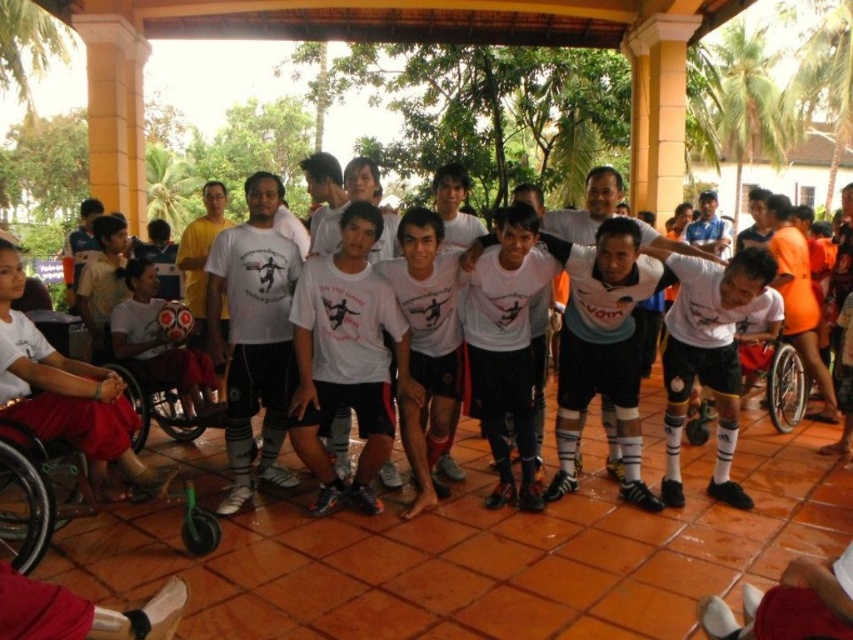
Question: Is silver metallic wheelchair at center in front of silver metallic wheelchair at left?

Choices:
 (A) no
 (B) yes

Answer: (A)

Question: Can you confirm if silver metallic wheelchair at center is wider than silver metallic wheelchair at left?

Choices:
 (A) no
 (B) yes

Answer: (A)

Question: Which point appears farthest from the camera in this image?

Choices:
 (A) (9, 419)
 (B) (374, 285)
 (C) (169, 433)
 (D) (772, 344)

Answer: (D)

Question: Which object appears closest to the camera in this image?

Choices:
 (A) matte white shirt at left
 (B) black plastic wheelchair at lower left
 (C) silver metallic wheelchair at center

Answer: (B)

Question: From the image, what is the correct spatial relationship of white matte jersey at center in relation to black plastic wheelchair at lower left?

Choices:
 (A) below
 (B) above

Answer: (B)

Question: Which point is closer to the camera taking this photo?

Choices:
 (A) (28, 476)
 (B) (312, 456)
 (C) (706, 433)
 (D) (172, 404)

Answer: (A)